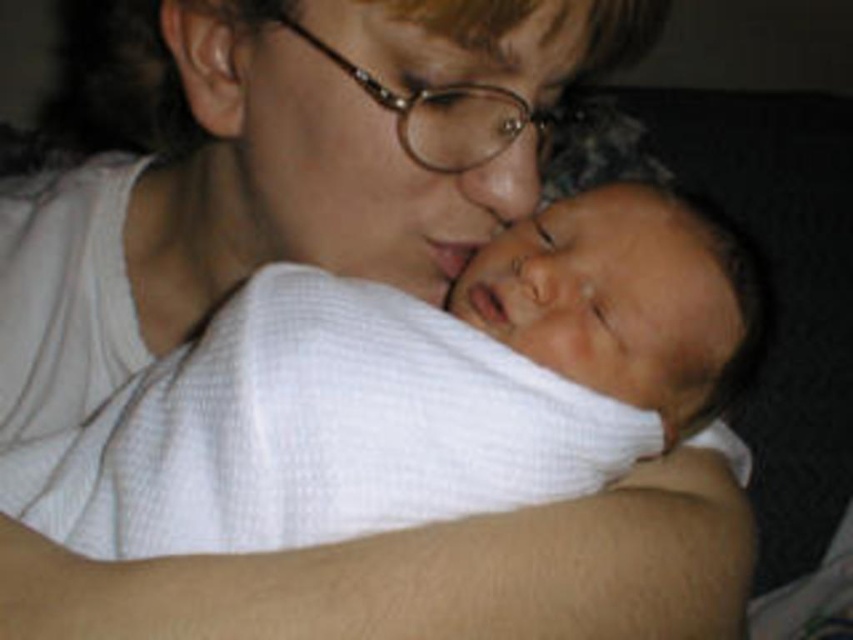
Question: Which point is farther to the camera?

Choices:
 (A) white cotton shirt at center
 (B) white textured cloth at center

Answer: (A)

Question: Where is white cotton shirt at center located in relation to soft beige arm at center in the image?

Choices:
 (A) right
 (B) left

Answer: (A)

Question: Which object is positioned closest to the soft beige arm at center?

Choices:
 (A) white cotton shirt at center
 (B) white textured cloth at center

Answer: (B)

Question: Considering the relative positions of white cotton shirt at center and soft beige arm at center in the image provided, where is white cotton shirt at center located with respect to soft beige arm at center?

Choices:
 (A) right
 (B) left

Answer: (A)

Question: Among these points, which one is farthest from the camera?

Choices:
 (A) (695, 380)
 (B) (421, 104)

Answer: (A)

Question: Can you confirm if white textured cloth at center is positioned to the left of soft beige arm at center?

Choices:
 (A) yes
 (B) no

Answer: (A)